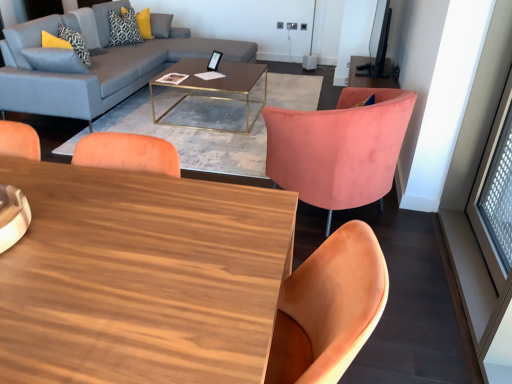
Question: Is velvet pink chair at center directly adjacent to wooden coffee table at center, which is counted as the second coffee table, starting from the back?

Choices:
 (A) yes
 (B) no

Answer: (B)

Question: Is velvet pink chair at center closer to camera compared to wooden coffee table at center, the first coffee table ordered from the bottom?

Choices:
 (A) no
 (B) yes

Answer: (A)

Question: From a real-world perspective, is velvet pink chair at center under wooden coffee table at center, the 2th coffee table from the top?

Choices:
 (A) yes
 (B) no

Answer: (B)

Question: Is velvet pink chair at center not inside wooden coffee table at center, the 2th coffee table from the top?

Choices:
 (A) no
 (B) yes

Answer: (B)

Question: Would you say velvet pink chair at center is a long distance from wooden coffee table at center, the first coffee table ordered from the bottom?

Choices:
 (A) no
 (B) yes

Answer: (B)

Question: Is wooden coffee table at center, the first coffee table positioned from the front, completely or partially inside velvet pink chair at center?

Choices:
 (A) yes
 (B) no

Answer: (B)

Question: Can you confirm if matte gray fabric couch at upper left is positioned to the left of patterned fabric pillow at upper left, the 2th pillow positioned from the back?

Choices:
 (A) no
 (B) yes

Answer: (A)

Question: Considering the relative sizes of matte gray fabric couch at upper left and patterned fabric pillow at upper left, the 1th pillow ordered from the bottom, in the image provided, is matte gray fabric couch at upper left thinner than patterned fabric pillow at upper left, the 1th pillow ordered from the bottom,?

Choices:
 (A) no
 (B) yes

Answer: (A)

Question: Is matte gray fabric couch at upper left closer to the viewer compared to patterned fabric pillow at upper left, acting as the first pillow starting from the front?

Choices:
 (A) yes
 (B) no

Answer: (A)

Question: From the image's perspective, is matte gray fabric couch at upper left over patterned fabric pillow at upper left, the 1th pillow ordered from the bottom?

Choices:
 (A) no
 (B) yes

Answer: (A)

Question: From the image's perspective, would you say matte gray fabric couch at upper left is shown under patterned fabric pillow at upper left, acting as the first pillow starting from the front?

Choices:
 (A) yes
 (B) no

Answer: (A)

Question: Is matte gray fabric couch at upper left to the right of patterned fabric pillow at upper left, the 2th pillow positioned from the back, from the viewer's perspective?

Choices:
 (A) no
 (B) yes

Answer: (B)

Question: Is velvet pink chair at center at the left side of matte gray fabric couch at upper left?

Choices:
 (A) no
 (B) yes

Answer: (A)